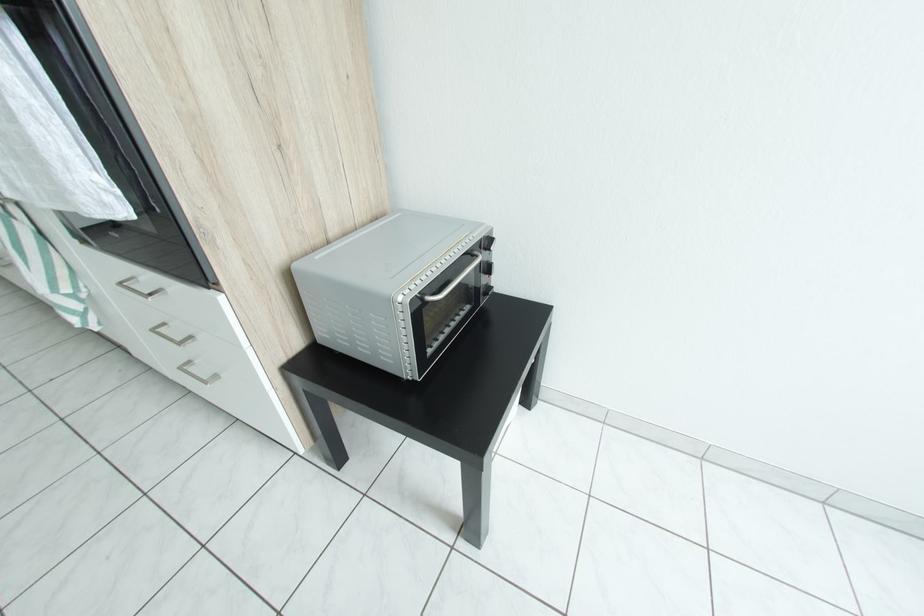
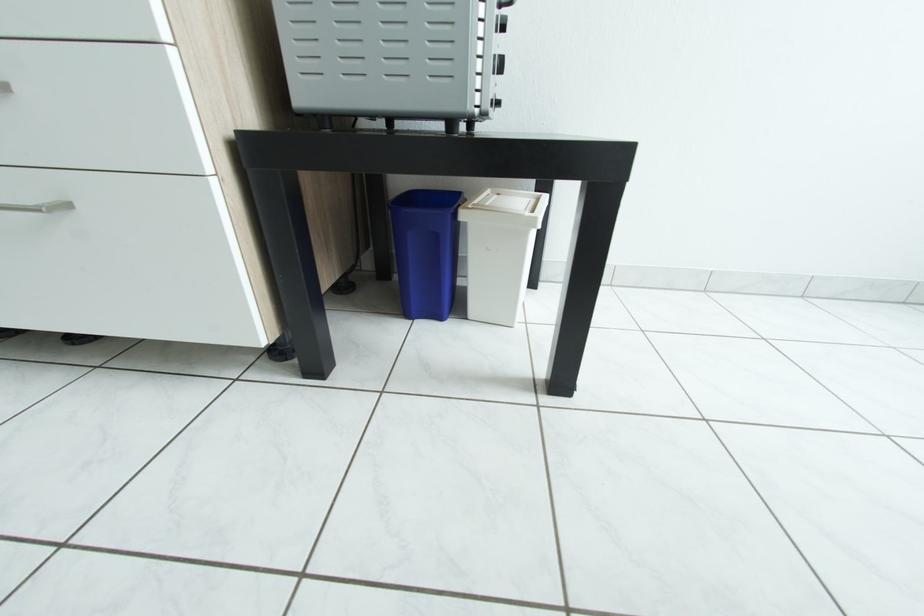
Question: The images are taken continuously from a first-person perspective. In which direction is your viewpoint rotating?

Choices:
 (A) Left
 (B) Right
 (C) Up
 (D) Down

Answer: (B)